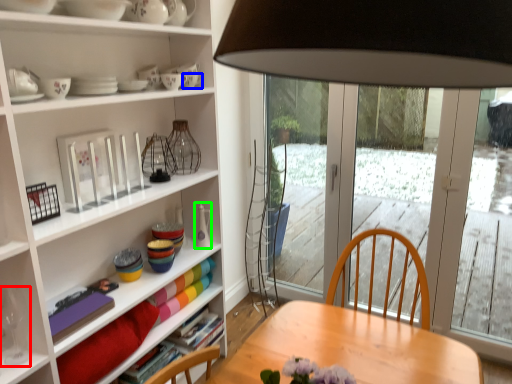
Question: Which object is positioned farthest from wine glass (highlighted by a red box)? Select from tableware (highlighted by a blue box) and tableware (highlighted by a green box).

Choices:
 (A) tableware
 (B) tableware

Answer: (A)